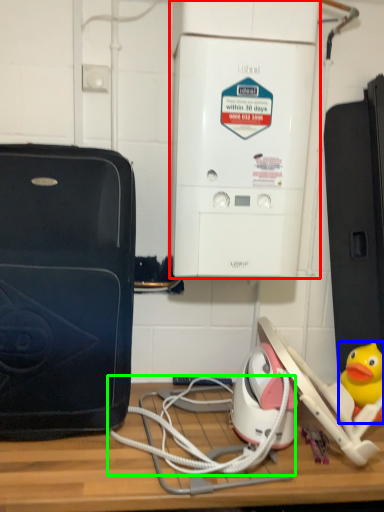
Question: Which object is the closest to the home appliance (highlighted by a red box)? Choose among these: toy (highlighted by a blue box) or cable (highlighted by a green box).

Choices:
 (A) toy
 (B) cable

Answer: (B)